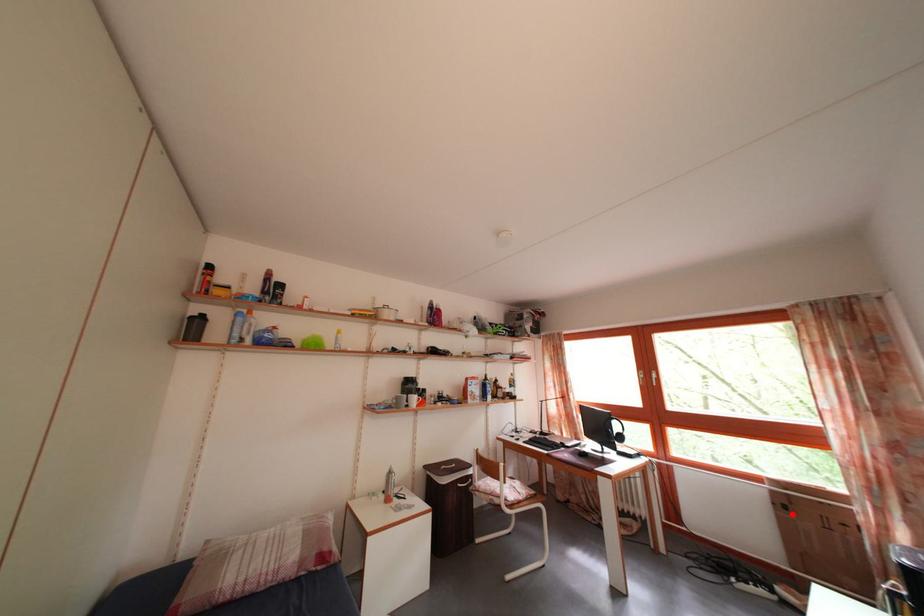
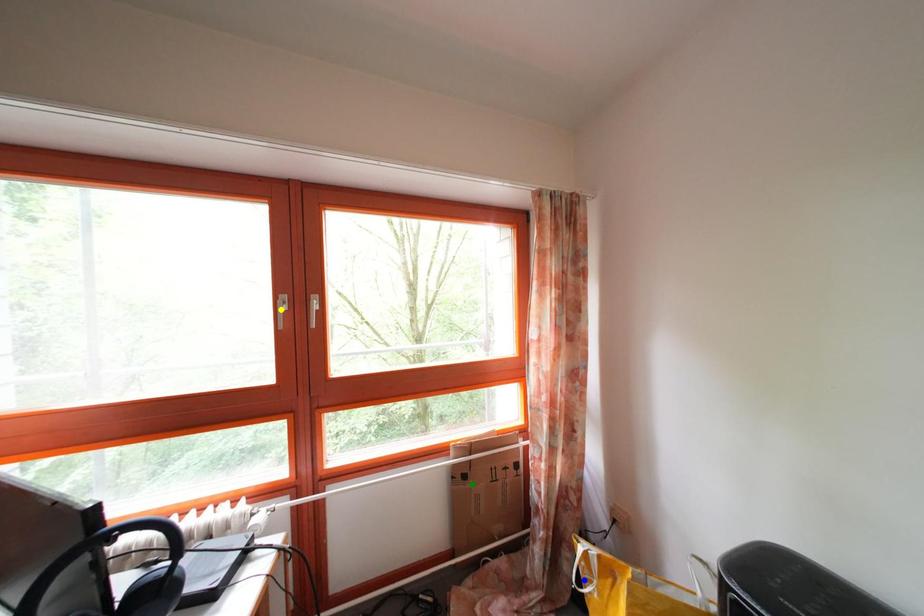
Question: I am providing you with two images of the same scene from different viewpoints. A red point is marked on the first image. You are given multiple points on the second image. In image 2, which mark is for the same physical point as the one in image 1?

Choices:
 (A) green point
 (B) yellow point
 (C) blue point

Answer: (A)